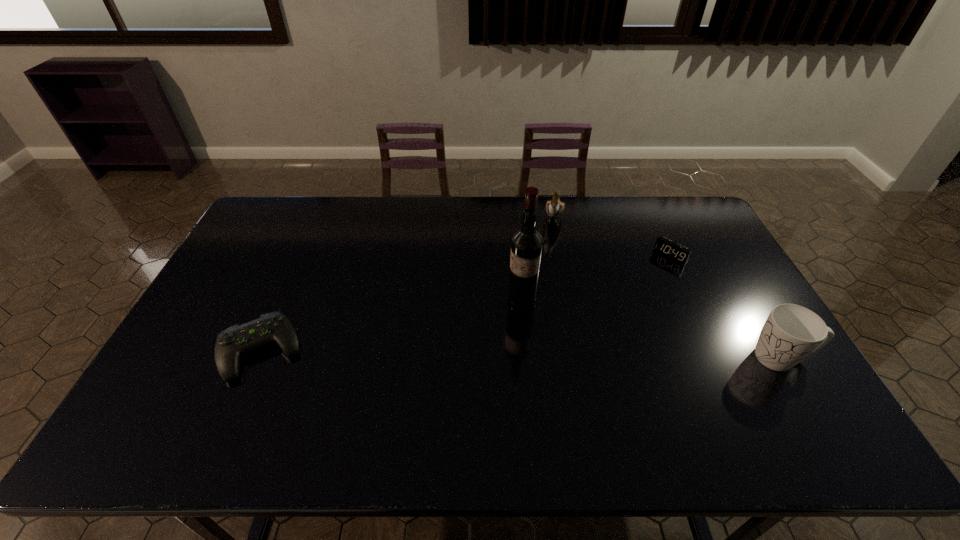
Where is `vacant space located 0.310m on the front and back of the third farthest object`? vacant space located 0.310m on the front and back of the third farthest object is located at coordinates (429, 368).

Locate an element on the screen. object present at the far edge is located at coordinates (554, 208).

Where is `control that is at the near edge`? Image resolution: width=960 pixels, height=540 pixels. control that is at the near edge is located at coordinates (236, 340).

I want to click on mug at the near edge, so click(791, 332).

Where is `object that is at the left edge`? Image resolution: width=960 pixels, height=540 pixels. object that is at the left edge is located at coordinates (236, 340).

Image resolution: width=960 pixels, height=540 pixels. Find the location of `mug that is at the right edge`. mug that is at the right edge is located at coordinates (791, 332).

Identify the location of alarm clock located in the right edge section of the desktop. (673, 250).

Locate an element on the screen. This screenshot has width=960, height=540. object that is at the near left corner is located at coordinates (236, 340).

Locate an element on the screen. Image resolution: width=960 pixels, height=540 pixels. object present at the near right corner is located at coordinates (791, 332).

Identify the location of vacant region at the far edge of the desktop. (505, 228).